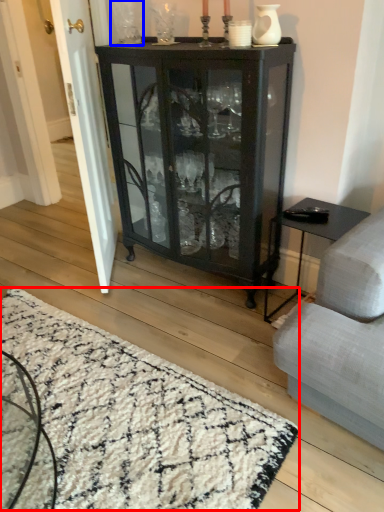
Question: Which point is closer to the camera, mat (highlighted by a red box) or glass vase (highlighted by a blue box)?

Choices:
 (A) mat
 (B) glass vase

Answer: (A)